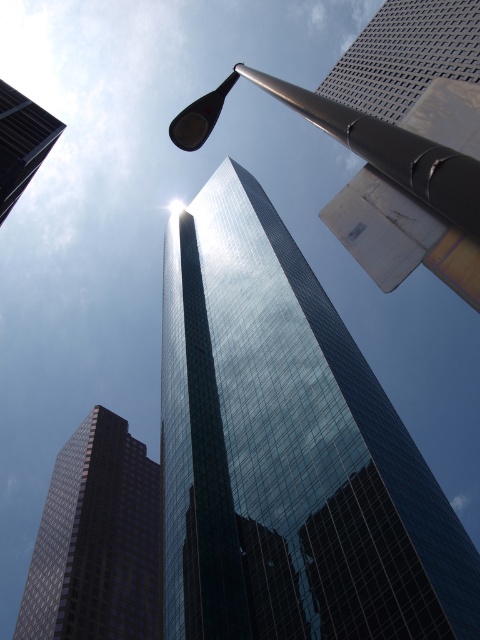
You are a drone operator trying to capture a photo of the dark glass skyscraper at center. You need to position your drone at coordinates that are 0.1 units to the left and 0.05 units above the skyscraper. What are the new coordinates for the drone?

The new coordinates would be 0.845 minus 0.1 equals 0.745 for the x coordinate, and 0.202 plus 0.05 equals 0.252 for the y coordinate. Therefore, the drone should be positioned at point (120, 476).

You are a drone operator planning to fly a drone between the dark glass skyscraper at center and the glassy reflective skyscraper at upper left. The drone has a wingspan of 1.2 meters. Can the drone safely navigate the space between them?

The distance between the dark glass skyscraper at center and the glassy reflective skyscraper at upper left is 79.87 meters. Since the drone has a wingspan of 1.2 meters, it can easily navigate the space between them as the distance is much wider than the drone.

Looking at this image, you are a drone operator trying to navigate a small drone through the city. Your drone is currently at coordinates point 0.25, 0.75. You need to fly it to the polished metal pole at upper center. What direction should you move the drone to reach the pole?

The polished metal pole at upper center is located at point (388,177). Since your drone is at (360,160), you should move it northeast to reach the pole.